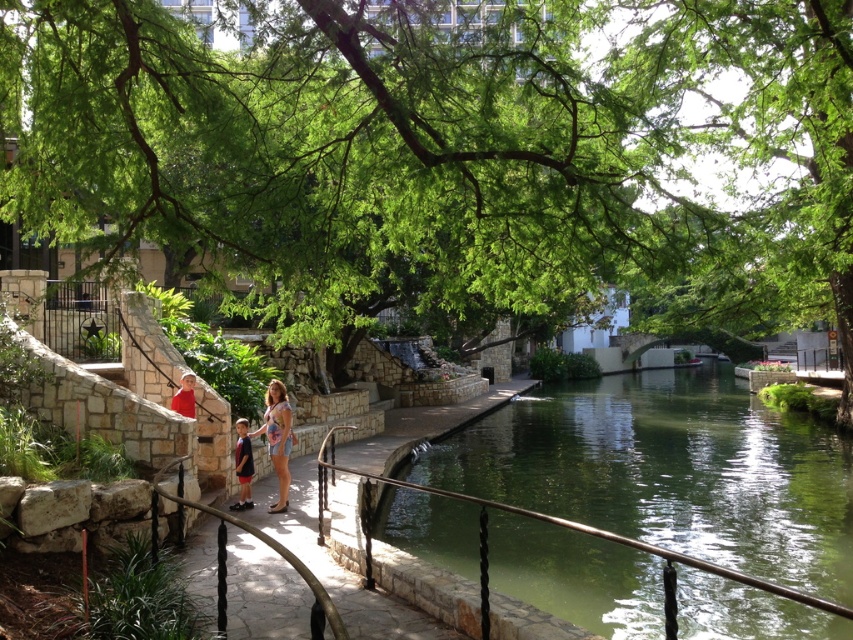
Question: Among these points, which one is nearest to the camera?

Choices:
 (A) (189, 396)
 (B) (639, 104)
 (C) (248, 465)

Answer: (B)

Question: Is floral denim shorts at center closer to camera compared to dark blue shorts at center?

Choices:
 (A) yes
 (B) no

Answer: (A)

Question: Where is dark blue shorts at center located in relation to matte red shirt at center in the image?

Choices:
 (A) below
 (B) above

Answer: (A)

Question: Which point appears closest to the camera in this image?

Choices:
 (A) click(x=386, y=68)
 (B) click(x=276, y=467)
 (C) click(x=239, y=499)

Answer: (A)

Question: Which point is closer to the camera?

Choices:
 (A) (183, 403)
 (B) (277, 381)
 (C) (409, 125)
 (D) (247, 458)

Answer: (C)

Question: Can you confirm if green leafy tree at upper center is smaller than green stone river at center?

Choices:
 (A) yes
 (B) no

Answer: (B)